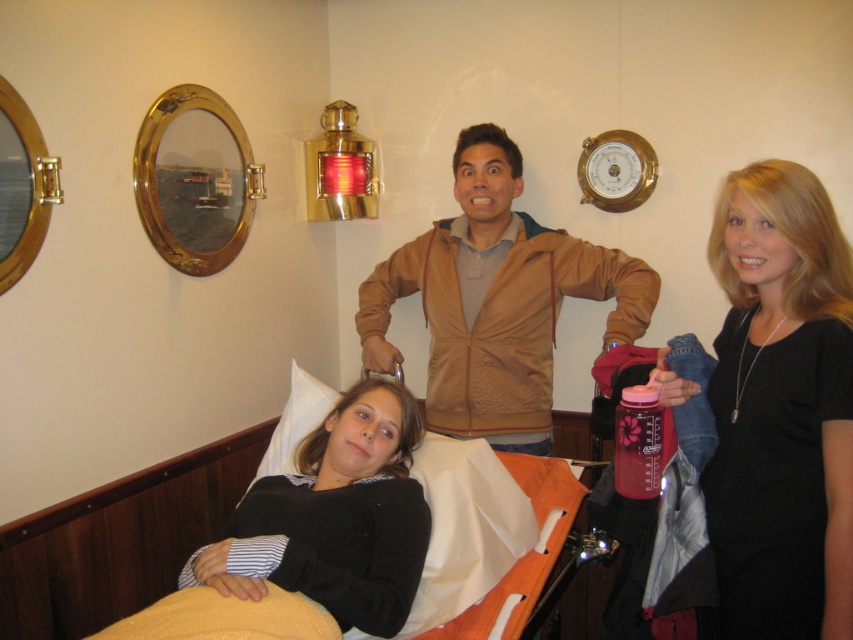
Question: Which point is farther from the camera taking this photo?

Choices:
 (A) (498, 340)
 (B) (779, 460)
 (C) (659, 467)

Answer: (A)

Question: Among these points, which one is farthest from the camera?

Choices:
 (A) (647, 381)
 (B) (479, 141)
 (C) (338, 595)

Answer: (B)

Question: Considering the relative positions of black matte dress at center and white soft pillow at lower center in the image provided, where is black matte dress at center located with respect to white soft pillow at lower center?

Choices:
 (A) right
 (B) left

Answer: (A)

Question: Can you confirm if black matte dress at center is thinner than white soft pillow at lower center?

Choices:
 (A) yes
 (B) no

Answer: (B)

Question: Observing the image, what is the correct spatial positioning of black matte dress at center in reference to brown textured jacket at center?

Choices:
 (A) above
 (B) below

Answer: (B)

Question: Which object is closer to the camera taking this photo?

Choices:
 (A) pink plastic water bottle at center
 (B) black matte dress at center

Answer: (B)